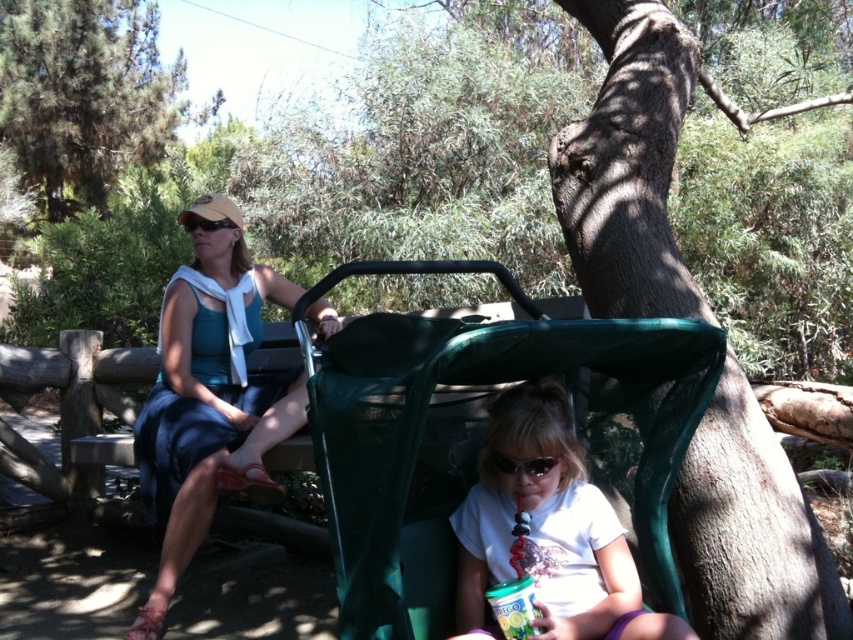
You are a photographer aiming to capture the matte blue dress at center and the green leafy tree at upper left in a single frame. Based on their positions, which object is closer to the camera?

The matte blue dress at center is closer to the camera because it is located below the green leafy tree at upper left, indicating it is positioned in the foreground.

You are a parent pushing the green mesh stroller at center through a narrow path that is only wide enough for objects narrower than the green leafy tree at upper left. Can the stroller pass through the path?

The green mesh stroller at center is narrower than the green leafy tree at upper left, so yes, the stroller can pass through the path since its width is less than the tree.

You are a photographer trying to capture a photo of the matte blue dress at center and the green leafy tree at upper left. Since the dress is smaller than the tree, how should you adjust your camera focus to ensure both are in focus?

The matte blue dress at center is smaller than the green leafy tree at upper left. To ensure both are in focus, you should adjust your camera focus to the matte blue dress at center first, as it is closer to the camera, and then use a smaller aperture for a deeper depth of field to include the green leafy tree at upper left in focus.